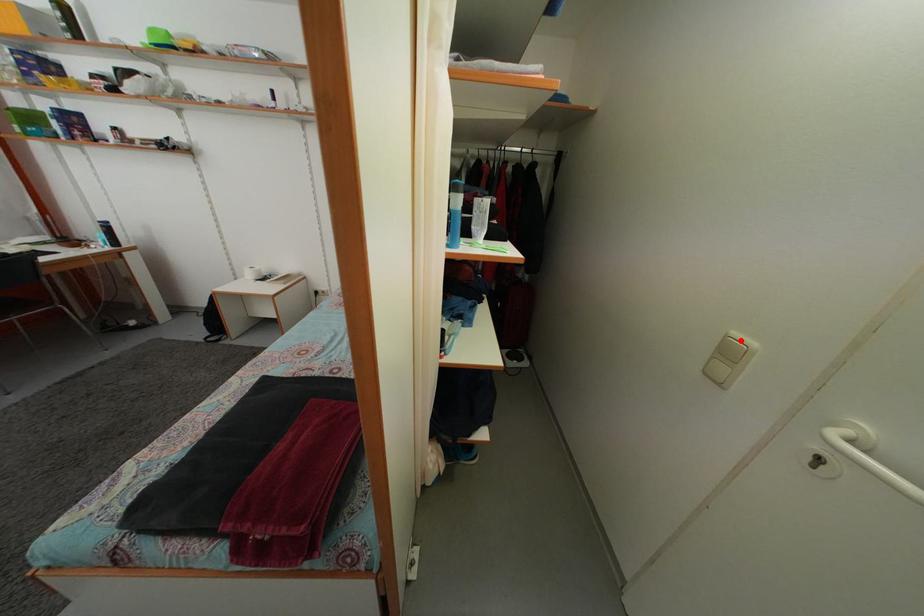
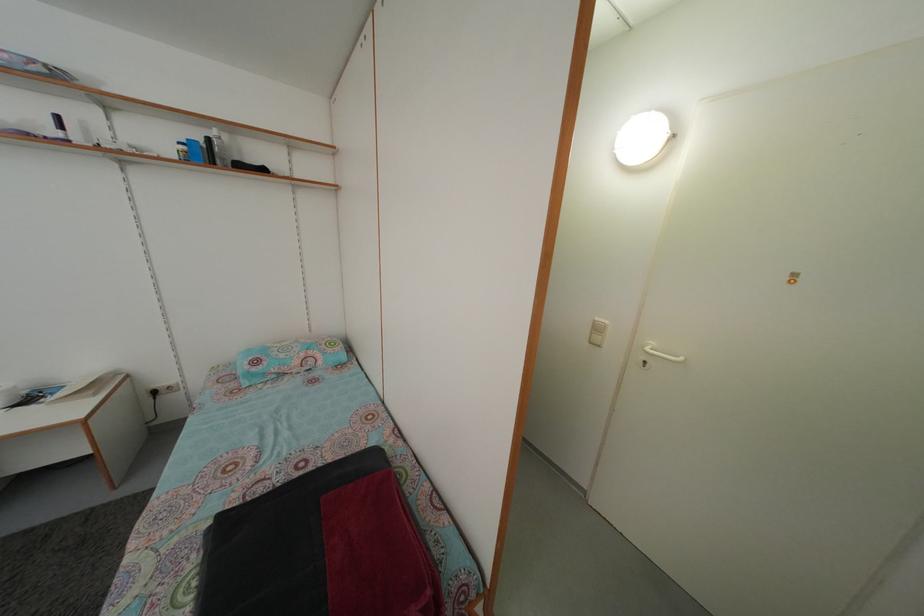
Locate, in the second image, the point that corresponds to the highlighted location in the first image.

(602, 326)